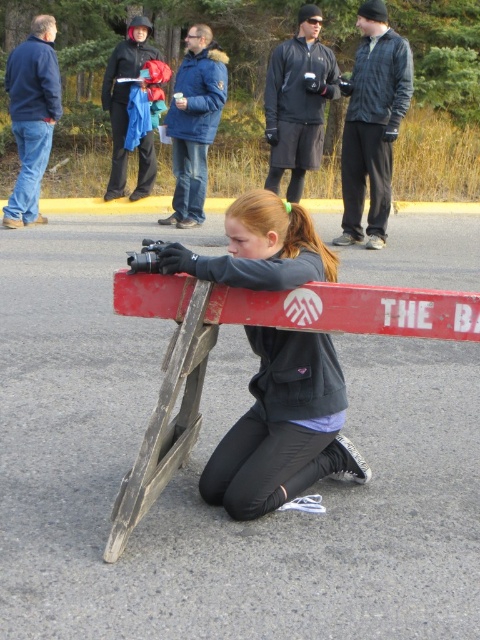
Is dark gray jacket at upper center positioned behind matte black jacket at upper center?

No, it is in front of matte black jacket at upper center.

Who is taller, dark gray jacket at upper center or matte black jacket at upper center?

With more height is dark gray jacket at upper center.

Which is in front, point (410, 93) or point (322, 134)?

Point (410, 93)

The image size is (480, 640). I want to click on dark gray jacket at upper center, so click(x=372, y=124).

Based on the photo, is matte gray jacket at center smaller than matte black jacket at upper center?

Indeed, matte gray jacket at center has a smaller size compared to matte black jacket at upper center.

Can you confirm if matte gray jacket at center is bigger than matte black jacket at upper center?

No.

Find the location of `matte gray jacket at center`. matte gray jacket at center is located at coordinates (283, 428).

Who is positioned more to the left, matte gray jacket at center or dark gray jacket at upper center?

Positioned to the left is matte gray jacket at center.

Does matte gray jacket at center appear over dark gray jacket at upper center?

Incorrect, matte gray jacket at center is not positioned above dark gray jacket at upper center.

Between point (296, 227) and point (356, 124), which one is positioned in front?

Positioned in front is point (296, 227).

This screenshot has height=640, width=480. In order to click on matte gray jacket at center in this screenshot , I will do `click(283, 428)`.